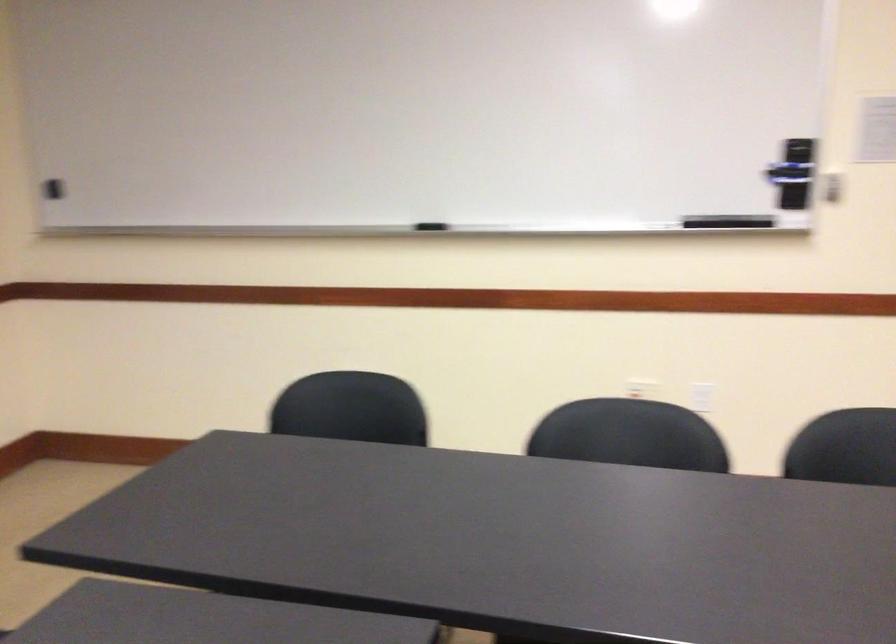
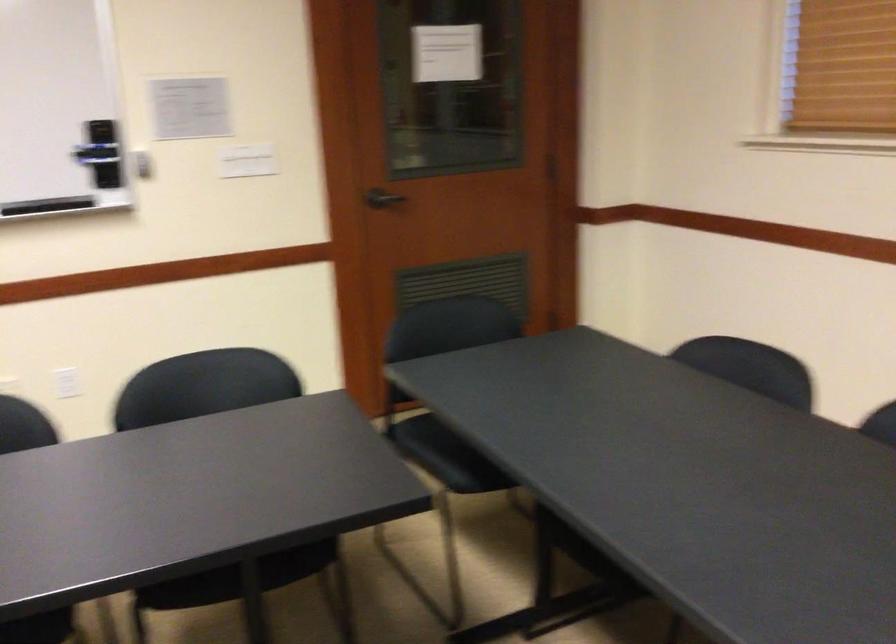
Question: The camera is either moving clockwise (left) or counter-clockwise (right) around the object. The first image is from the beginning of the video and the second image is from the end. Is the camera moving left or right when shooting the video?

Choices:
 (A) Left
 (B) Right

Answer: (A)